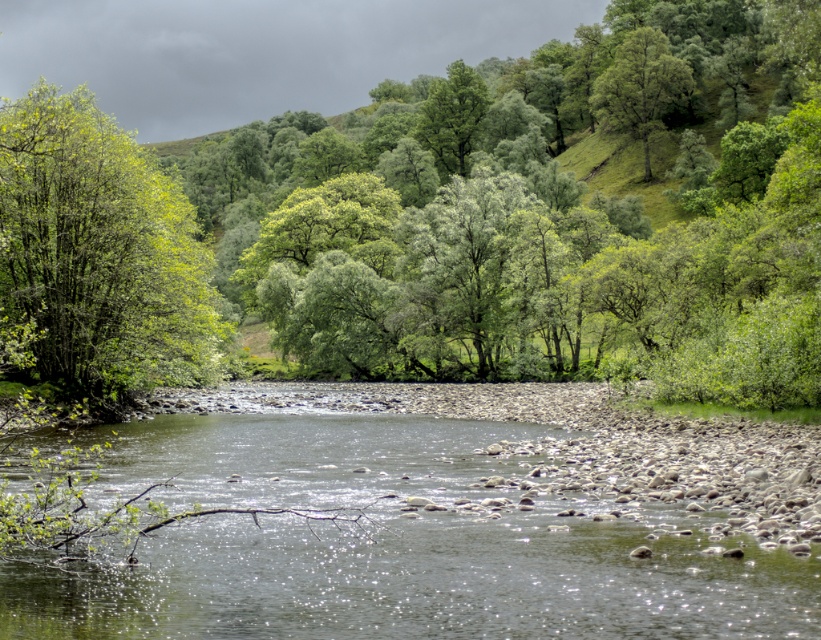
Question: Can you confirm if green leafy tree at left is bigger than green leafy tree at upper right?

Choices:
 (A) no
 (B) yes

Answer: (B)

Question: Which object is farther from the camera taking this photo?

Choices:
 (A) green leafy tree at center
 (B) green leafy tree at upper right

Answer: (B)

Question: Does clear water at center have a lesser width compared to green leafy tree at upper right?

Choices:
 (A) yes
 (B) no

Answer: (B)

Question: Which point is closer to the camera?

Choices:
 (A) (17, 256)
 (B) (624, 106)
 (C) (629, 513)

Answer: (C)

Question: Does clear water at center come behind green leafy tree at left?

Choices:
 (A) no
 (B) yes

Answer: (B)

Question: Which of the following is the closest to the observer?

Choices:
 (A) green leafy tree at left
 (B) green leafy tree at center
 (C) clear water at center

Answer: (A)